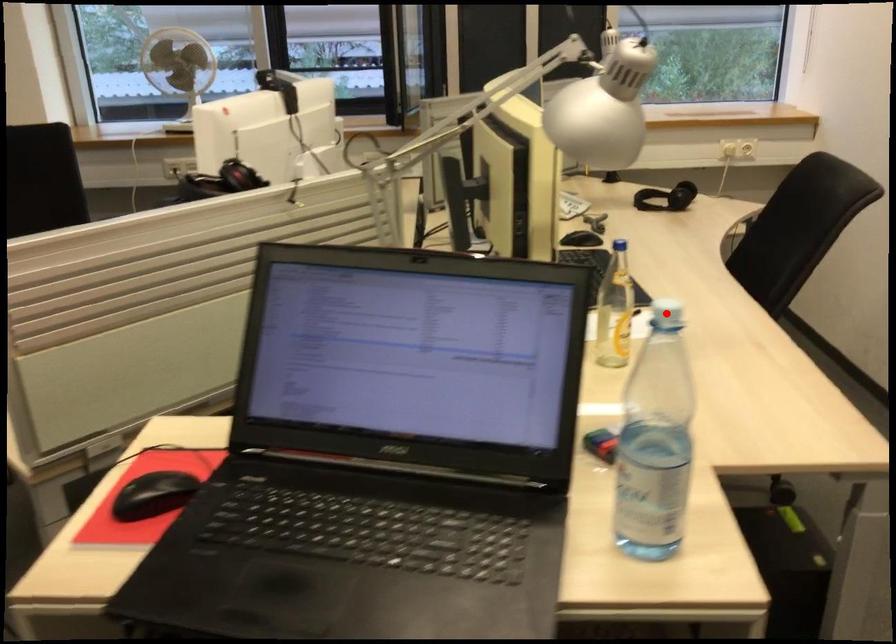
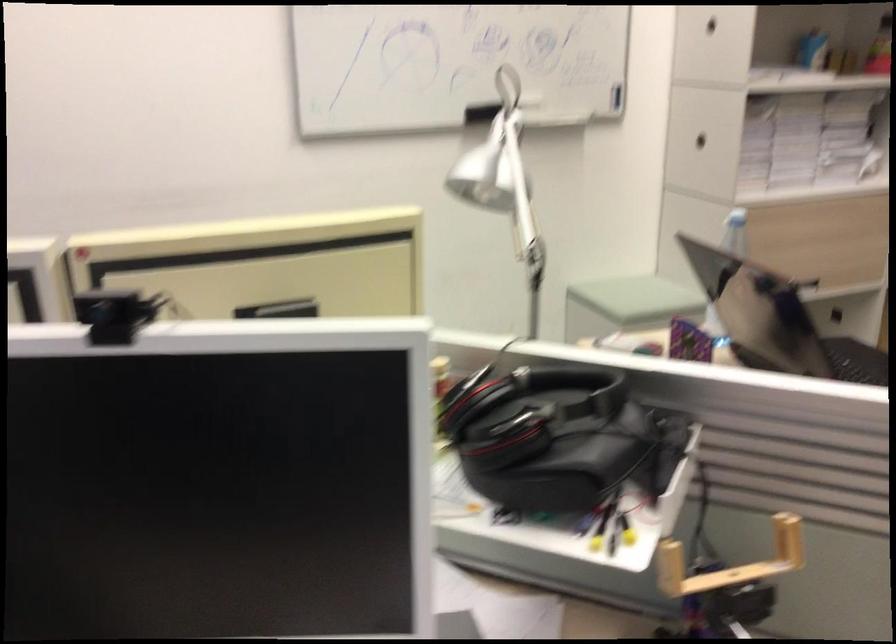
Question: I am providing you with two images of the same scene from different viewpoints. A red point is marked on the first image. At the location where the point appears in image 1, is it still visible in image 2?

Choices:
 (A) Yes
 (B) No

Answer: (B)